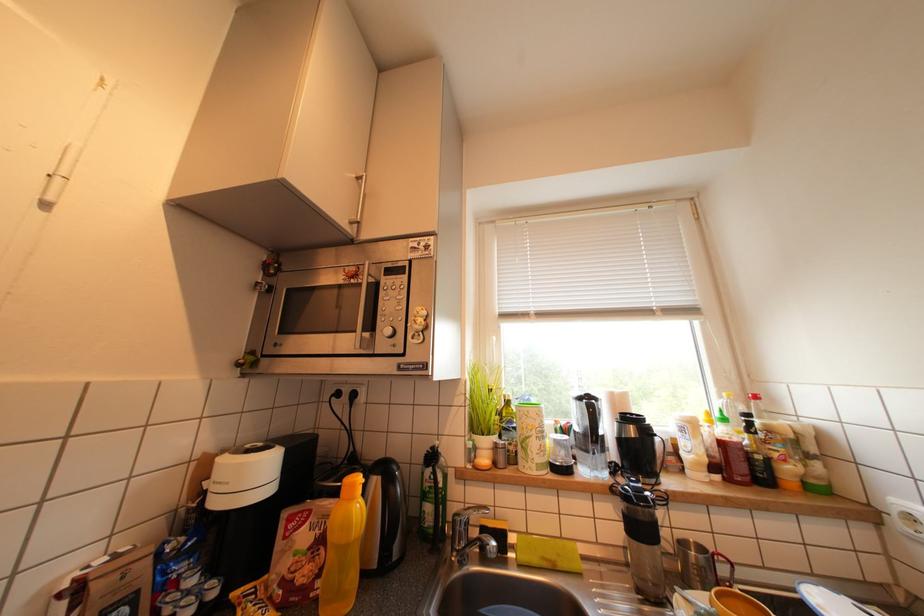
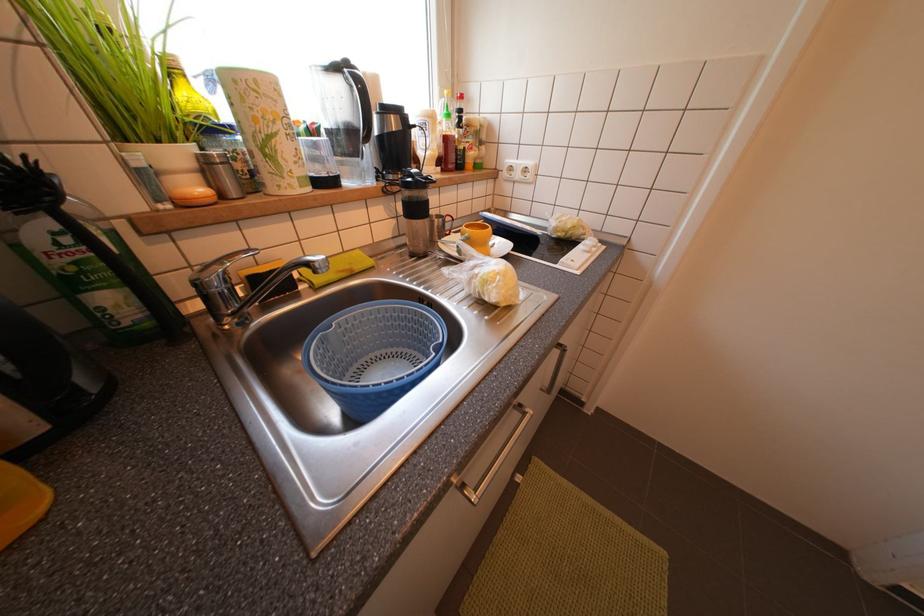
How did the camera likely rotate?

The camera rotated toward right-down.